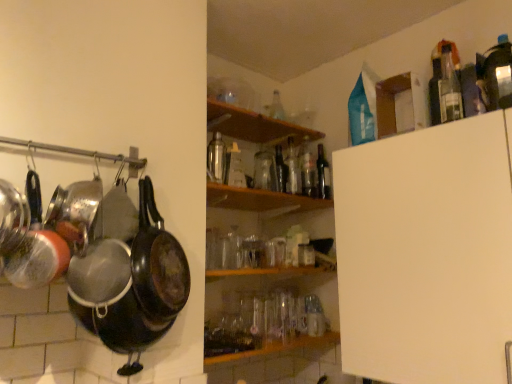
Describe the element at coordinates (449, 88) in the screenshot. The height and width of the screenshot is (384, 512). I see `clear glass bottle at upper right, which is the 1th bottle from right to left` at that location.

Measure the distance between clear glass bottle at upper right, the sixth bottle positioned from the back, and camera.

clear glass bottle at upper right, the sixth bottle positioned from the back, and camera are 4.23 feet apart from each other.

Describe the element at coordinates (292, 169) in the screenshot. I see `transparent glass bottle at center, which ranks as the fourth bottle in front-to-back order` at that location.

What is the approximate height of transparent glass bottle at center, which is counted as the 3th bottle, starting from the left?

transparent glass bottle at center, which is counted as the 3th bottle, starting from the left, is 10.90 inches tall.

What do you see at coordinates (216, 159) in the screenshot?
I see `transparent glass bottle at upper center, which is the 2th bottle from front to back` at bounding box center [216, 159].

Measure the distance between transparent glass bottle at upper center, which is the 2th bottle from front to back, and camera.

A distance of 1.85 meters exists between transparent glass bottle at upper center, which is the 2th bottle from front to back, and camera.

What do you see at coordinates (157, 262) in the screenshot? I see `black matte frying pan at left` at bounding box center [157, 262].

Where is `wooden shelf at upper center, which is the 2th shelf from bottom to top`? The height and width of the screenshot is (384, 512). wooden shelf at upper center, which is the 2th shelf from bottom to top is located at coordinates (254, 125).

Where is `clear glass bottle at upper right, the sixth bottle positioned from the left`? clear glass bottle at upper right, the sixth bottle positioned from the left is located at coordinates (449, 88).

Is wooden shelf at center, which ranks as the 1th shelf in bottom-to-top order, aimed at transparent glass bottle at center, which is counted as the 3th bottle, starting from the left?

No, wooden shelf at center, which ranks as the 1th shelf in bottom-to-top order, is not turned towards transparent glass bottle at center, which is counted as the 3th bottle, starting from the left.

Can you confirm if wooden shelf at center, the 2th shelf when ordered from top to bottom, is wider than transparent glass bottle at center, which ranks as the fourth bottle in front-to-back order?

Correct, the width of wooden shelf at center, the 2th shelf when ordered from top to bottom, exceeds that of transparent glass bottle at center, which ranks as the fourth bottle in front-to-back order.

Considering the sizes of objects wooden shelf at center, which ranks as the 1th shelf in bottom-to-top order, and transparent glass bottle at center, which is counted as the 3th bottle, starting from the back, in the image provided, who is taller, wooden shelf at center, which ranks as the 1th shelf in bottom-to-top order, or transparent glass bottle at center, which is counted as the 3th bottle, starting from the back,?

With more height is transparent glass bottle at center, which is counted as the 3th bottle, starting from the back.

Is wooden shelf at center, which ranks as the 1th shelf in bottom-to-top order, placed right next to transparent glass bottle at center, which is counted as the 3th bottle, starting from the back?

No, wooden shelf at center, which ranks as the 1th shelf in bottom-to-top order, is not beside transparent glass bottle at center, which is counted as the 3th bottle, starting from the back.

How far apart are transparent glass bottle at upper center, which is counted as the 5th bottle, starting from the back, and clear glass bottle at center, acting as the second bottle starting from the back?

The distance of transparent glass bottle at upper center, which is counted as the 5th bottle, starting from the back, from clear glass bottle at center, acting as the second bottle starting from the back, is 16.32 inches.

Could you tell me if transparent glass bottle at upper center, which is the 2th bottle from front to back, is turned towards clear glass bottle at center, positioned as the 3th bottle in right-to-left order?

No.

The height and width of the screenshot is (384, 512). Find the location of `the 3rd bottle to the left when counting from the clear glass bottle at center, the fourth bottle viewed from the left`. the 3rd bottle to the left when counting from the clear glass bottle at center, the fourth bottle viewed from the left is located at coordinates (216, 159).

From a real-world perspective, is transparent glass bottle at upper center, which is the 2th bottle from front to back, on clear glass bottle at center, the fourth bottle viewed from the left?

Actually, transparent glass bottle at upper center, which is the 2th bottle from front to back, is physically below clear glass bottle at center, the fourth bottle viewed from the left, in the real world.

In terms of size, does transparent glass bottle at center, positioned as the 2th bottle in left-to-right order, appear bigger or smaller than clear glass bottle at upper right, the sixth bottle positioned from the left?

In the image, transparent glass bottle at center, positioned as the 2th bottle in left-to-right order, appears to be larger than clear glass bottle at upper right, the sixth bottle positioned from the left.

Does transparent glass bottle at center, positioned as the 3th bottle in front-to-back order, lie behind clear glass bottle at upper right, the sixth bottle positioned from the left?

Yes.

From a real-world perspective, is transparent glass bottle at center, positioned as the fourth bottle in back-to-front order, on top of clear glass bottle at upper right, the sixth bottle positioned from the left?

Incorrect, from a real-world perspective, transparent glass bottle at center, positioned as the fourth bottle in back-to-front order, is lower than clear glass bottle at upper right, the sixth bottle positioned from the left.

Considering the positions of point (278, 163) and point (440, 85), is point (278, 163) closer or farther from the camera than point (440, 85)?

Point (278, 163) appears to be farther away from the viewer than point (440, 85).

Between transparent glass bottle at center, positioned as the 3th bottle in front-to-back order, and transparent glass bottle at upper center, which is the 2th bottle from front to back, which one has larger size?

transparent glass bottle at upper center, which is the 2th bottle from front to back, is bigger.

Which is behind, point (279, 184) or point (216, 147)?

The point (216, 147) is behind.

Does transparent glass bottle at center, which ranks as the fifth bottle in right-to-left order, touch transparent glass bottle at upper center, which appears as the 6th bottle when viewed from the right?

There is a gap between transparent glass bottle at center, which ranks as the fifth bottle in right-to-left order, and transparent glass bottle at upper center, which appears as the 6th bottle when viewed from the right.

Is transparent glass bottle at upper center, the 1th bottle viewed from the left, surrounded by transparent glass bottle at center, which ranks as the fifth bottle in right-to-left order?

That's incorrect, transparent glass bottle at upper center, the 1th bottle viewed from the left, is not inside transparent glass bottle at center, which ranks as the fifth bottle in right-to-left order.

Is black matte frying pan at left looking in the opposite direction of transparent glass bottle at upper center, which is counted as the 5th bottle, starting from the back?

No, black matte frying pan at left is not facing away from transparent glass bottle at upper center, which is counted as the 5th bottle, starting from the back.

Considering the relative sizes of black matte frying pan at left and transparent glass bottle at upper center, which is the 2th bottle from front to back, in the image provided, is black matte frying pan at left smaller than transparent glass bottle at upper center, which is the 2th bottle from front to back,?

Incorrect, black matte frying pan at left is not smaller in size than transparent glass bottle at upper center, which is the 2th bottle from front to back.

Do you think black matte frying pan at left is within transparent glass bottle at upper center, the 1th bottle viewed from the left, or outside of it?

black matte frying pan at left is spatially situated outside transparent glass bottle at upper center, the 1th bottle viewed from the left.

In the image, there is a transparent glass bottle at upper center, which is counted as the 5th bottle, starting from the back. Identify the location of frying pan below it (from the image's perspective). The width and height of the screenshot is (512, 384). (157, 262).

Is black matte frying pan at left beside clear glass bottle at center, acting as the second bottle starting from the back?

No, black matte frying pan at left is not in contact with clear glass bottle at center, acting as the second bottle starting from the back.

You are a GUI agent. You are given a task and a screenshot of the screen. Output one action in this format:
    pyautogui.click(x=<x>, y=<y>)
    Task: Click on the frying pan that is below the clear glass bottle at center, positioned as the 3th bottle in right-to-left order (from the image's perspective)
    
    Given the screenshot: What is the action you would take?
    pyautogui.click(x=157, y=262)

Is black matte frying pan at left turned away from clear glass bottle at center, acting as the second bottle starting from the back?

No.

Is black matte frying pan at left spatially inside clear glass bottle at center, acting as the second bottle starting from the back, or outside of it?

black matte frying pan at left cannot be found inside clear glass bottle at center, acting as the second bottle starting from the back.

Which of these two, clear glass bottle at upper right, the sixth bottle positioned from the left, or clear glass bottle at center, the fourth bottle viewed from the left, stands taller?

clear glass bottle at upper right, the sixth bottle positioned from the left.

Can you confirm if clear glass bottle at upper right, arranged as the first bottle when viewed from the front, is bigger than clear glass bottle at center, the 5th bottle from the front?

Incorrect, clear glass bottle at upper right, arranged as the first bottle when viewed from the front, is not larger than clear glass bottle at center, the 5th bottle from the front.

Does clear glass bottle at upper right, the sixth bottle positioned from the left, come in front of clear glass bottle at center, positioned as the 3th bottle in right-to-left order?

A: Yes, it is in front of clear glass bottle at center, positioned as the 3th bottle in right-to-left order.

Find the location of a particular element. the 3rd bottle behind the wooden shelf at center, which ranks as the 1th shelf in bottom-to-top order, counting from the anchor's position is located at coordinates (292, 169).

Locate an element on the screen. Image resolution: width=512 pixels, height=384 pixels. the 3rd bottle to the left of the clear glass bottle at center, positioned as the 3th bottle in right-to-left order, counting from the anchor's position is located at coordinates (216, 159).

Looking at the image, which one is located further to transparent glass bottle at upper center, the 1th bottle viewed from the left, dark glass bottle at upper center, which is counted as the second bottle, starting from the right, or wooden shelf at center, which ranks as the 1th shelf in bottom-to-top order?

dark glass bottle at upper center, which is counted as the second bottle, starting from the right, lies further to transparent glass bottle at upper center, the 1th bottle viewed from the left, than the other object.

From the image, which object appears to be farther from dark glass bottle at upper center, positioned as the first bottle in back-to-front order, transparent glass bottle at center, positioned as the fourth bottle in back-to-front order, or wooden shelf at upper center, which is the 2th shelf from bottom to top?

wooden shelf at upper center, which is the 2th shelf from bottom to top, is positioned further to the anchor dark glass bottle at upper center, positioned as the first bottle in back-to-front order.

Looking at the image, which one is located further to transparent glass bottle at center, which is counted as the 3th bottle, starting from the back, wooden shelf at center, the 2th shelf when ordered from top to bottom, or transparent glass bottle at center, which ranks as the fifth bottle in right-to-left order?

Based on the image, wooden shelf at center, the 2th shelf when ordered from top to bottom, appears to be further to transparent glass bottle at center, which is counted as the 3th bottle, starting from the back.

Considering their positions, is clear glass bottle at center, the 5th bottle from the front, positioned closer to clear glass bottle at upper right, which is the 1th bottle from right to left, than wooden shelf at upper center, which is the 2th shelf from bottom to top?

clear glass bottle at center, the 5th bottle from the front.

From the image, which object appears to be nearer to black matte frying pan at left, transparent glass bottle at center, which is counted as the 3th bottle, starting from the back, or clear glass bottle at center, the fourth bottle viewed from the left?

transparent glass bottle at center, which is counted as the 3th bottle, starting from the back, is closer to black matte frying pan at left.

Which object lies further to the anchor point clear glass bottle at upper right, the sixth bottle positioned from the back, dark glass bottle at upper center, arranged as the 5th bottle when viewed from the left, or wooden shelf at upper center, which is the 2th shelf from bottom to top?

Among the two, wooden shelf at upper center, which is the 2th shelf from bottom to top, is located further to clear glass bottle at upper right, the sixth bottle positioned from the back.

Considering their positions, is transparent glass bottle at center, which ranks as the fourth bottle in front-to-back order, positioned closer to transparent glass bottle at upper center, which appears as the 6th bottle when viewed from the right, than clear glass bottle at center, the 5th bottle from the front?

Among the two, transparent glass bottle at center, which ranks as the fourth bottle in front-to-back order, is located nearer to transparent glass bottle at upper center, which appears as the 6th bottle when viewed from the right.

From the image, which object appears to be farther from transparent glass bottle at upper center, which is the 2th bottle from front to back, clear glass bottle at upper right, the sixth bottle positioned from the left, or black matte frying pan at left?

Among the two, clear glass bottle at upper right, the sixth bottle positioned from the left, is located further to transparent glass bottle at upper center, which is the 2th bottle from front to back.

Identify the location of bottle between wooden shelf at center, which ranks as the 1th shelf in bottom-to-top order, and transparent glass bottle at center, which ranks as the fifth bottle in right-to-left order, in the front-back direction. Image resolution: width=512 pixels, height=384 pixels. (216, 159).

Identify the location of shelf between wooden shelf at upper center, which is the 2th shelf from bottom to top, and clear glass bottle at upper right, which is the 1th bottle from right to left, from left to right. The height and width of the screenshot is (384, 512). (260, 199).

Where is `shelf located between black matte frying pan at left and wooden shelf at upper center, which is the 2th shelf from bottom to top, in the depth direction`? The image size is (512, 384). shelf located between black matte frying pan at left and wooden shelf at upper center, which is the 2th shelf from bottom to top, in the depth direction is located at coordinates (260, 199).

Where is `bottle between transparent glass bottle at center, which ranks as the fourth bottle in front-to-back order, and dark glass bottle at upper center, positioned as the first bottle in back-to-front order`? The width and height of the screenshot is (512, 384). bottle between transparent glass bottle at center, which ranks as the fourth bottle in front-to-back order, and dark glass bottle at upper center, positioned as the first bottle in back-to-front order is located at coordinates (307, 171).